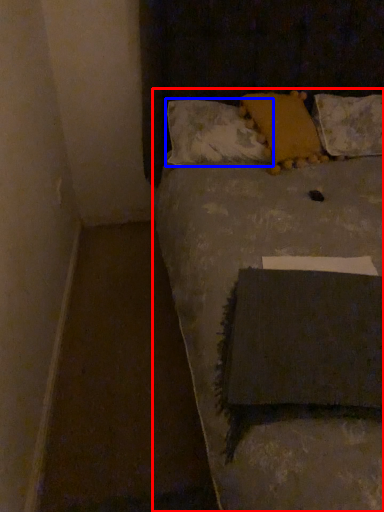
Question: Which of the following is the closest to the observer, furniture (highlighted by a red box) or pillow (highlighted by a blue box)?

Choices:
 (A) furniture
 (B) pillow

Answer: (A)